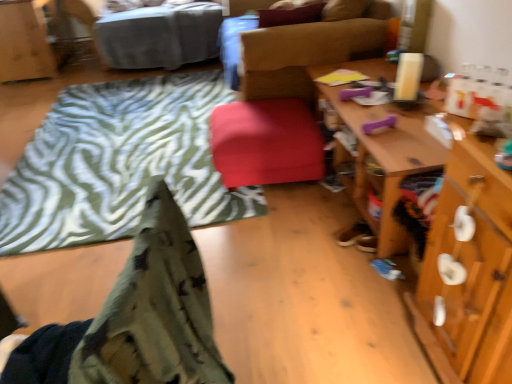
Question: Should I look upward or downward to see wooden cabinet at upper left?

Choices:
 (A) down
 (B) up

Answer: (B)

Question: Is gray fabric bed at upper left not within velvet-like brown chair at center?

Choices:
 (A) no
 (B) yes

Answer: (B)

Question: Can you confirm if gray fabric bed at upper left is positioned to the left of velvet-like brown chair at center?

Choices:
 (A) no
 (B) yes

Answer: (B)

Question: Can you confirm if gray fabric bed at upper left is wider than velvet-like brown chair at center?

Choices:
 (A) yes
 (B) no

Answer: (A)

Question: Is gray fabric bed at upper left beside velvet-like brown chair at center?

Choices:
 (A) no
 (B) yes

Answer: (A)

Question: Is gray fabric bed at upper left behind velvet-like brown chair at center?

Choices:
 (A) yes
 (B) no

Answer: (A)

Question: Is gray fabric bed at upper left to the right of velvet-like brown chair at center from the viewer's perspective?

Choices:
 (A) no
 (B) yes

Answer: (A)

Question: Considering the relative sizes of velvet-like brown chair at center and gray fabric bed at upper left in the image provided, is velvet-like brown chair at center bigger than gray fabric bed at upper left?

Choices:
 (A) no
 (B) yes

Answer: (B)

Question: Can you confirm if velvet-like brown chair at center is positioned to the left of gray fabric bed at upper left?

Choices:
 (A) yes
 (B) no

Answer: (B)

Question: Are velvet-like brown chair at center and gray fabric bed at upper left far apart?

Choices:
 (A) no
 (B) yes

Answer: (B)

Question: Is velvet-like brown chair at center turned away from gray fabric bed at upper left?

Choices:
 (A) yes
 (B) no

Answer: (B)

Question: Does velvet-like brown chair at center have a lesser height compared to gray fabric bed at upper left?

Choices:
 (A) yes
 (B) no

Answer: (B)

Question: Is velvet-like brown chair at center closer to the viewer compared to gray fabric bed at upper left?

Choices:
 (A) yes
 (B) no

Answer: (A)

Question: Considering the relative sizes of wooden cabinet at upper left and matte red stool at center in the image provided, is wooden cabinet at upper left wider than matte red stool at center?

Choices:
 (A) no
 (B) yes

Answer: (B)